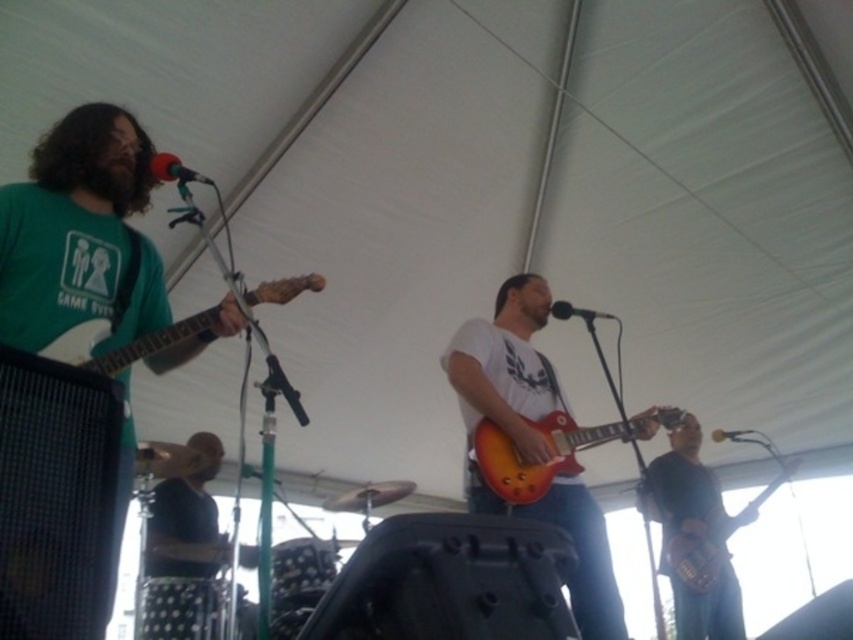
You are a photographer setting up for a live music shoot. You need to adjust the lighting so that the white matte guitar at left and the black matte microphone at center are both well lit. Based on their positions, which object should you adjust the light first to ensure proper exposure?

The white matte guitar at left is positioned under the black matte microphone at center. Since it is below the microphone, it might be in a shadowed area. Adjust the light for the white matte guitar at left first to ensure it receives adequate illumination before adjusting for the microphone.